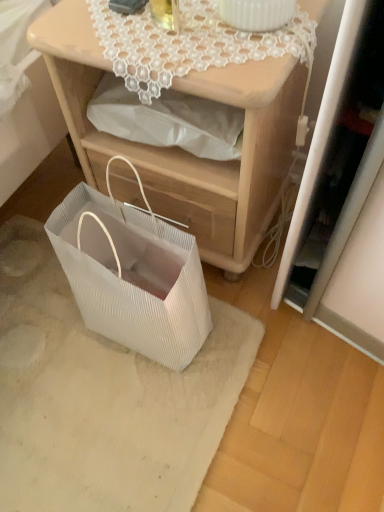
The width and height of the screenshot is (384, 512). Find the location of `vacant area that is situated to the right of white pleated paper bag at lower left`. vacant area that is situated to the right of white pleated paper bag at lower left is located at coordinates (277, 332).